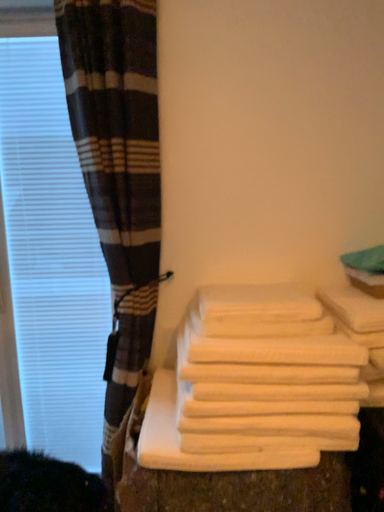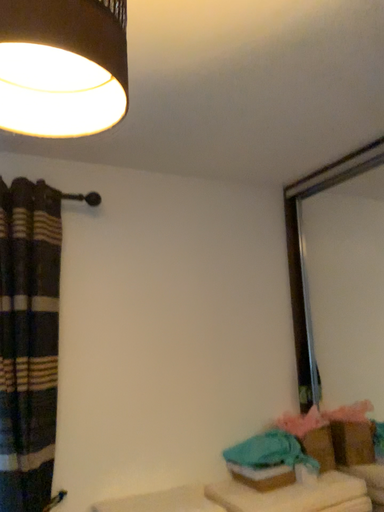
Question: Which way did the camera rotate in the video?

Choices:
 (A) rotated right
 (B) rotated left

Answer: (A)